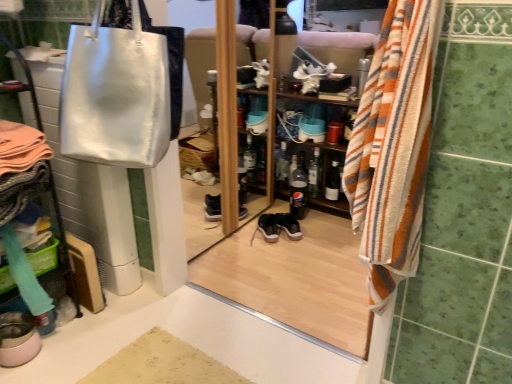
Identify the location of vacant area that lies between metallic silver bowl at lower left, marked as the first footwear in a front-to-back arrangement, and beige textured bath mat at lower center. (81, 350).